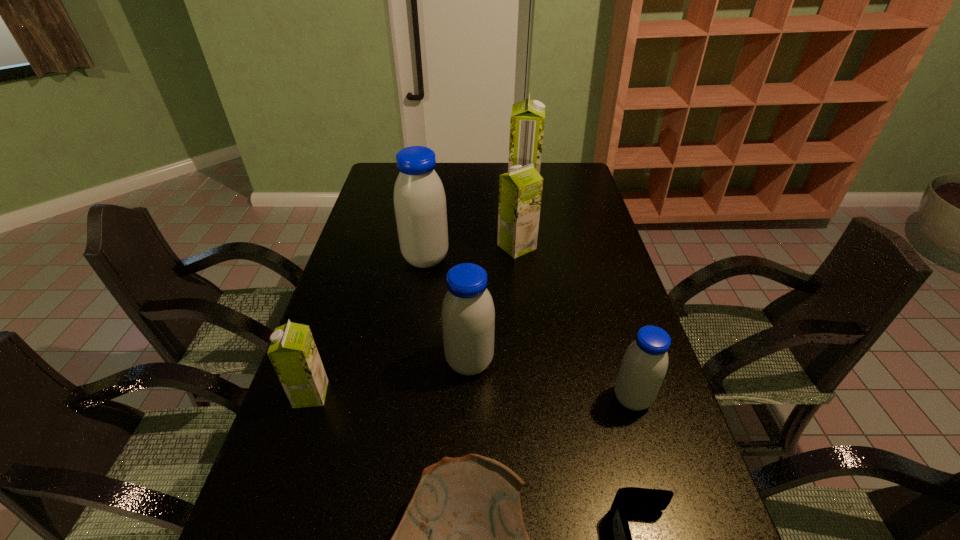
At what (x,y) coordinates should I click in order to perform the action: click on vacant space that satisfies the following two spatial constraints: 1. on the back side of the farthest green soya milk; 2. on the right side of the second nearest blue soya milk. Please return your answer as a coordinate pair (x, y). Looking at the image, I should click on (473, 192).